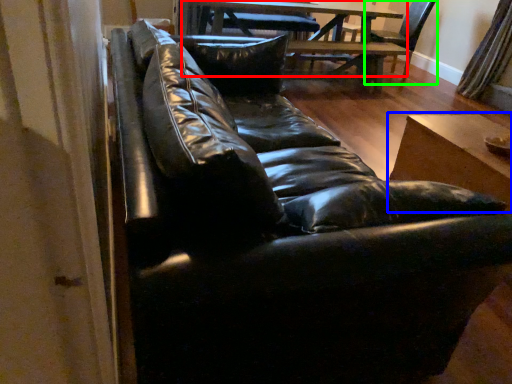
Question: Estimate the real-world distances between objects in this image. Which object is farther from table (highlighted by a red box), table (highlighted by a blue box) or swivel chair (highlighted by a green box)?

Choices:
 (A) table
 (B) swivel chair

Answer: (A)